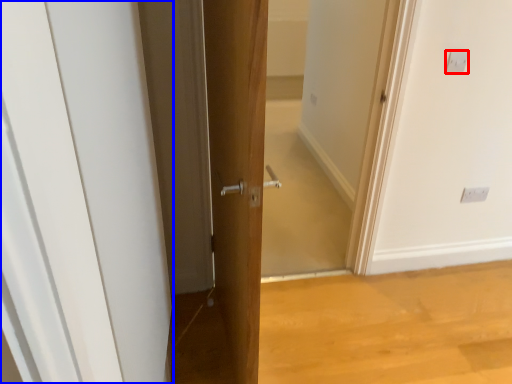
Question: Among these objects, which one is farthest to the camera, electric outlet (highlighted by a red box) or door (highlighted by a blue box)?

Choices:
 (A) electric outlet
 (B) door

Answer: (A)